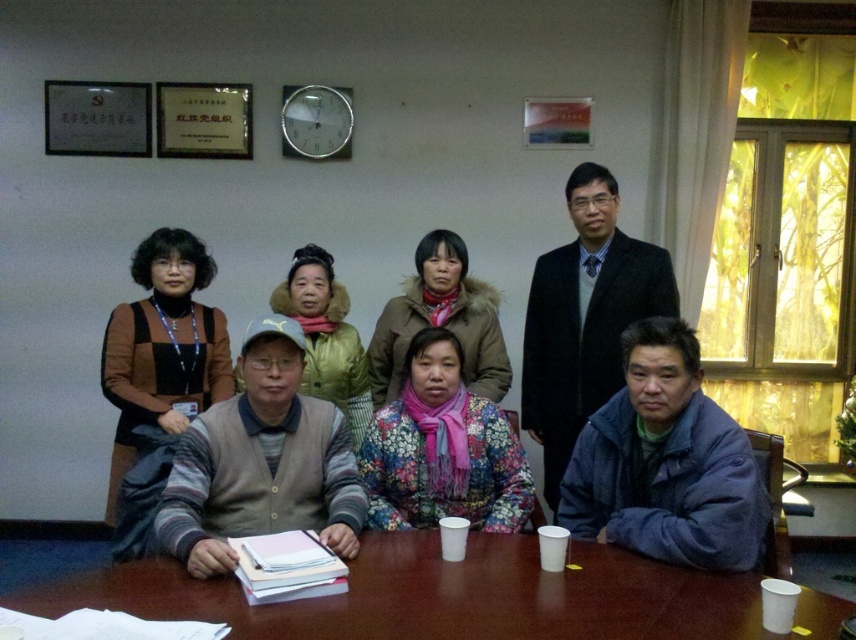
You are organizing a small event and need to place a large decorative centerpiece on the brown wooden table at center. Given the size of the table and the fluffy brown coat at center, will the table be able to accommodate the centerpiece without the coat obstructing it?

The brown wooden table at center has a smaller size compared to the fluffy brown coat at center, so the table might not have enough space to accommodate a large decorative centerpiece without the coat obstructing it.

You are organizing a presentation and need to ensure that the floral fabric scarf at center and the matte yellow jacket at center can be displayed side by side on a narrow shelf. Based on their widths, will they fit together on a shelf that is 1 meter wide?

The floral fabric scarf at center might be wider than matte yellow jacket at center, so it is uncertain if they will fit together on a 1 meter wide shelf without knowing the exact widths of both items.

From the picture: In the meeting scene, there is a fluffy brown coat at center. Where exactly is it located in terms of coordinates?

The fluffy brown coat at center is located at point coordinates of (440, 321).